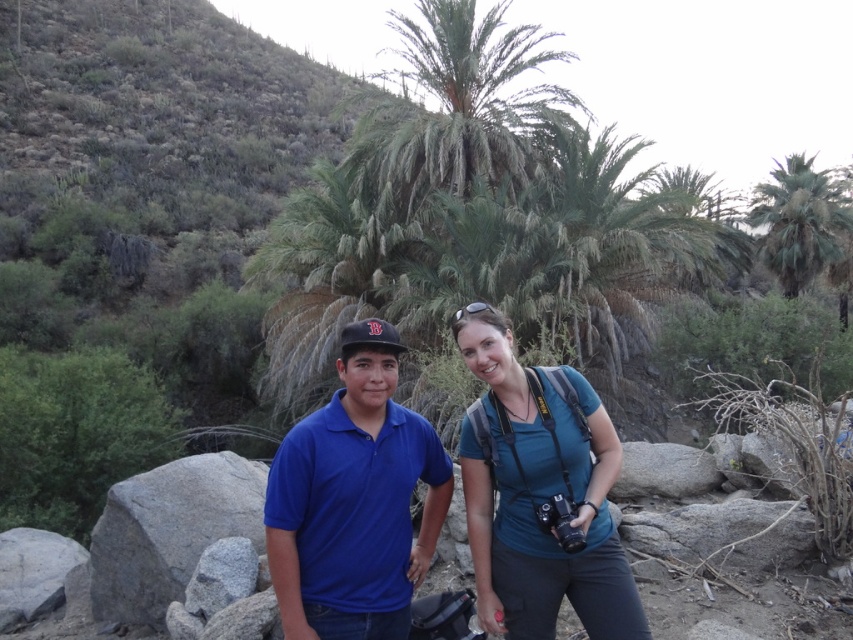
From the picture: Who is higher up, matte blue polo shirt at center or gray granite rock at lower left?

Positioned higher is matte blue polo shirt at center.

The width and height of the screenshot is (853, 640). Describe the element at coordinates (354, 500) in the screenshot. I see `matte blue polo shirt at center` at that location.

Find the location of a particular element. The width and height of the screenshot is (853, 640). matte blue polo shirt at center is located at coordinates (354, 500).

Which of these two, blue cotton shirt at center or gray granite rock at lower left, stands taller?

blue cotton shirt at center

Can you confirm if blue cotton shirt at center is smaller than gray granite rock at lower left?

Yes, blue cotton shirt at center is smaller than gray granite rock at lower left.

Is point (561, 472) positioned in front of point (218, 500)?

Yes, it is.

Find the location of `blue cotton shirt at center`. blue cotton shirt at center is located at coordinates (540, 497).

Does point (212, 509) come farther from viewer compared to point (762, 243)?

No, (212, 509) is closer to viewer.

Measure the distance between point (x=94, y=576) and camera.

They are 5.80 meters apart.

Is point (260, 541) positioned after point (775, 205)?

No.

What are the coordinates of `gray granite rock at lower left` in the screenshot? It's located at (169, 531).